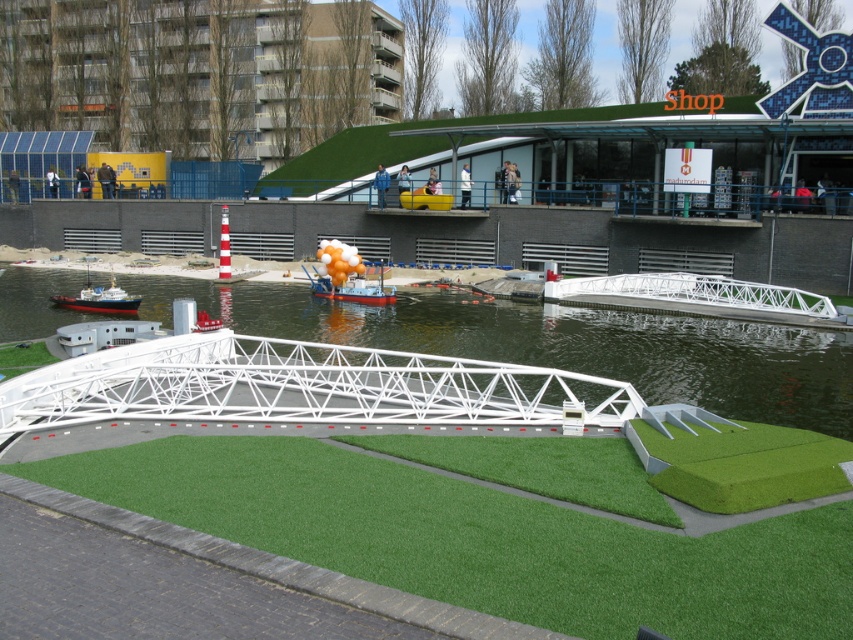
You are a toy boat collector who wants to display your orange glossy boat at center in the miniature canal scene. Given the size of the white plastic water at center, will there be enough space for the boat to move freely?

The white plastic water at center is larger in size than the orange glossy boat at center, so there should be enough space for the boat to move freely.

You are a visitor at the canal model exhibit and want to take a photo of the orange glossy boat at center. Since the white plastic water at center is in the way, can you adjust your angle to capture the boat without the water obstructing the view?

The white plastic water at center is located below the orange glossy boat at center, so you can adjust your angle to look down from above to capture the boat without the water blocking the view.